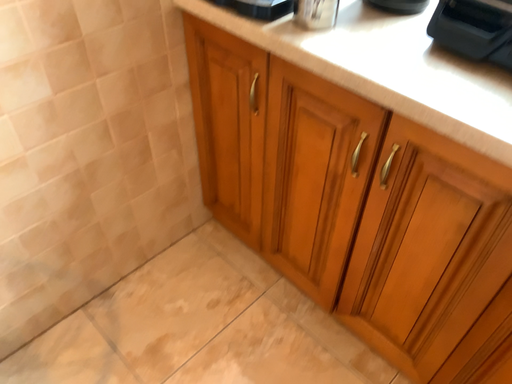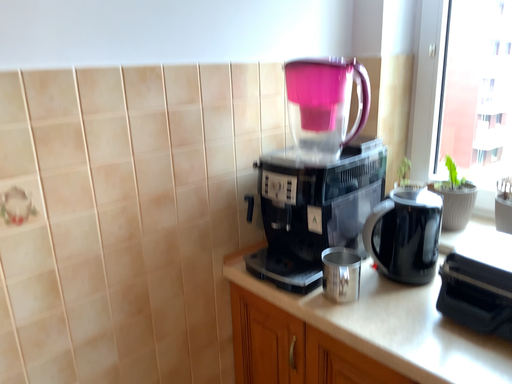
Question: Which way did the camera rotate in the video?

Choices:
 (A) rotated downward
 (B) rotated upward

Answer: (B)